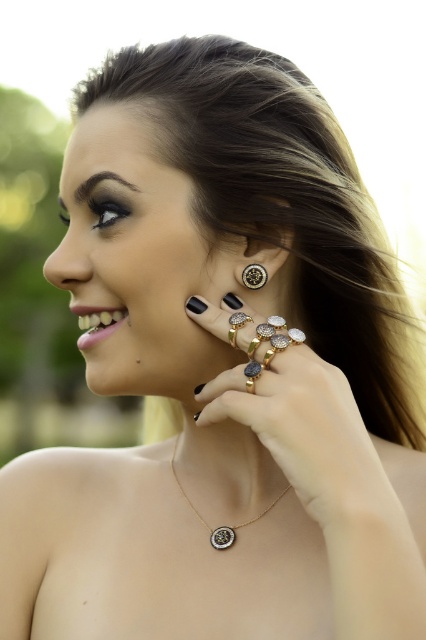
Between point (241, 200) and point (173, 460), which one is positioned in front?

Point (241, 200) is in front.

Who is shorter, gold textured earring at upper right or gold metallic necklace at center?

With less height is gold metallic necklace at center.

Who is more forward, (282, 221) or (238, 524)?

Point (282, 221)

Locate an element on the screen. This screenshot has width=426, height=640. gold textured earring at upper right is located at coordinates click(x=267, y=225).

Does gold metallic necklace at center come in front of gold metallic ring at upper right?

That is False.

Who is shorter, gold metallic necklace at center or gold metallic ring at upper right?

gold metallic ring at upper right

This screenshot has width=426, height=640. What do you see at coordinates (219, 525) in the screenshot? I see `gold metallic necklace at center` at bounding box center [219, 525].

Identify the location of gold metallic necklace at center. The width and height of the screenshot is (426, 640). (219, 525).

Can you confirm if gold textured earring at upper right is positioned to the left of gold metallic ring at upper right?

No, gold textured earring at upper right is not to the left of gold metallic ring at upper right.

Is gold textured earring at upper right to the right of gold metallic ring at upper right from the viewer's perspective?

Correct, you'll find gold textured earring at upper right to the right of gold metallic ring at upper right.

Does point (253, 221) come closer to viewer compared to point (236, 346)?

No, (253, 221) is further to viewer.

You are a GUI agent. You are given a task and a screenshot of the screen. Output one action in this format:
    pyautogui.click(x=<x>, y=<y>)
    Task: Click on the gold textured earring at upper right
    Image resolution: width=426 pixels, height=640 pixels.
    Given the screenshot: What is the action you would take?
    pyautogui.click(x=267, y=225)